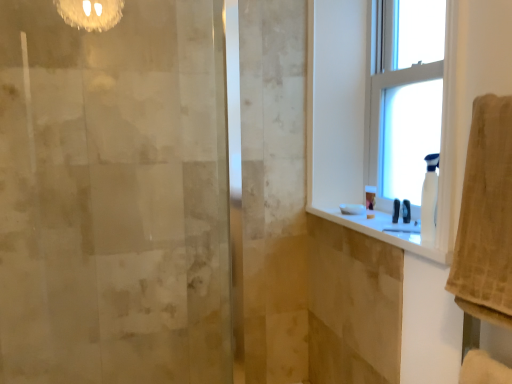
Locate an element on the screen. The image size is (512, 384). free point above white glossy counter top at upper right (from a real-world perspective) is located at coordinates (384, 226).